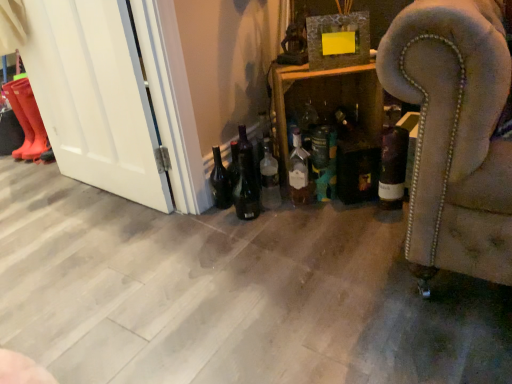
Question: Is matte glass bottle at lower left, placed as the 2th beer bottle when sorted from right to left, at the right side of rubber boots at left, the 2th boot viewed from the right?

Choices:
 (A) no
 (B) yes

Answer: (B)

Question: From a real-world perspective, is matte glass bottle at lower left, placed as the 2th beer bottle when sorted from right to left, physically above rubber boots at left, the 2th boot viewed from the right?

Choices:
 (A) yes
 (B) no

Answer: (B)

Question: From the image's perspective, is matte glass bottle at lower left, the 1th beer bottle from the left, over rubber boots at left, the first boot viewed from the left?

Choices:
 (A) yes
 (B) no

Answer: (B)

Question: Can you confirm if matte glass bottle at lower left, the 1th beer bottle from the left, is wider than rubber boots at left, the first boot viewed from the left?

Choices:
 (A) yes
 (B) no

Answer: (B)

Question: Is matte glass bottle at lower left, placed as the 2th beer bottle when sorted from right to left, thinner than rubber boots at left, the first boot viewed from the left?

Choices:
 (A) no
 (B) yes

Answer: (B)

Question: Is matte glass bottle at lower left, placed as the 2th beer bottle when sorted from right to left, in front of or behind green matte bottle at center, the 3th bottle from the right, in the image?

Choices:
 (A) front
 (B) behind

Answer: (B)

Question: From a real-world perspective, is matte glass bottle at lower left, the 1th beer bottle from the left, positioned above or below green matte bottle at center, the 3th bottle from the right?

Choices:
 (A) above
 (B) below

Answer: (B)

Question: Is point (230, 198) closer or farther from the camera than point (329, 198)?

Choices:
 (A) farther
 (B) closer

Answer: (A)

Question: From their relative heights in the image, would you say matte glass bottle at lower left, the 1th beer bottle from the left, is taller or shorter than green matte bottle at center, arranged as the third bottle when viewed from the left?

Choices:
 (A) short
 (B) tall

Answer: (A)

Question: Is green matte bottle at center, the 3th bottle from the right, bigger or smaller than translucent glass bottle at center, which is the 5th bottle from right to left?

Choices:
 (A) small
 (B) big

Answer: (B)

Question: From a real-world perspective, is green matte bottle at center, arranged as the third bottle when viewed from the left, physically located above or below translucent glass bottle at center, which is the 5th bottle from right to left?

Choices:
 (A) below
 (B) above

Answer: (B)

Question: Is point (317, 147) positioned closer to the camera than point (265, 183)?

Choices:
 (A) farther
 (B) closer

Answer: (B)

Question: Considering the positions of green matte bottle at center, the 3th bottle from the right, and translucent glass bottle at center, placed as the first bottle when sorted from left to right, in the image, is green matte bottle at center, the 3th bottle from the right, taller or shorter than translucent glass bottle at center, placed as the first bottle when sorted from left to right,?

Choices:
 (A) tall
 (B) short

Answer: (A)

Question: Is matte glass bottle at center, which is counted as the 4th bottle, starting from the right, situated inside black glass beer bottle at lower center, acting as the first beer bottle starting from the right, or outside?

Choices:
 (A) inside
 (B) outside

Answer: (B)

Question: From the image's perspective, relative to black glass beer bottle at lower center, acting as the first beer bottle starting from the right, is matte glass bottle at center, which appears as the 2th bottle when viewed from the left, above or below?

Choices:
 (A) above
 (B) below

Answer: (A)